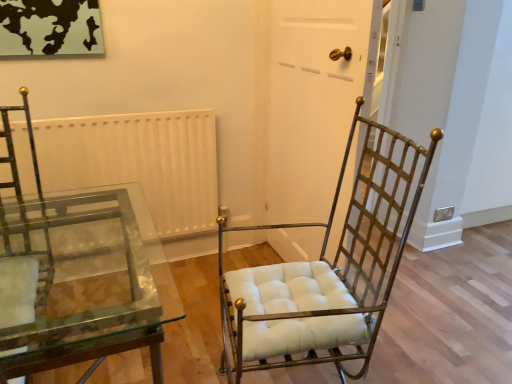
Question: Do you think transparent glass table at lower left is within white matte door at center, or outside of it?

Choices:
 (A) outside
 (B) inside

Answer: (A)

Question: From the image's perspective, is transparent glass table at lower left above or below white matte door at center?

Choices:
 (A) above
 (B) below

Answer: (B)

Question: Which of these objects is positioned closest to the white matte radiator at upper center?

Choices:
 (A) transparent glass table at lower left
 (B) white matte door at center
 (C) gold metal/texture chair at center

Answer: (A)

Question: Which of these objects is positioned farthest from the white matte door at center?

Choices:
 (A) transparent glass table at lower left
 (B) white matte radiator at upper center
 (C) gold metal/texture chair at center

Answer: (A)